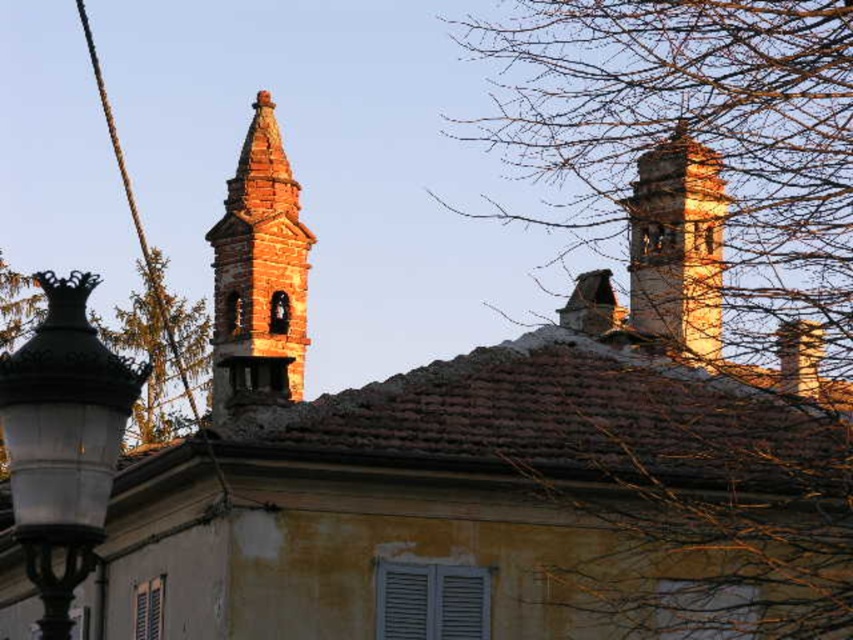
You are standing at the center of the image. Which direction should you look to see the brown stone tower at upper right?

You should look to the upper right direction to see the brown stone tower at upper right as it is located at point (x=677, y=244).

Looking at this image, you are a visitor standing in front of the building and notice the rustic stone bell tower at upper left and the rope at left. Which object is closer to you?

The rope at left is closer to you because it is larger in size compared to the rustic stone bell tower at upper left, indicating it is nearer.